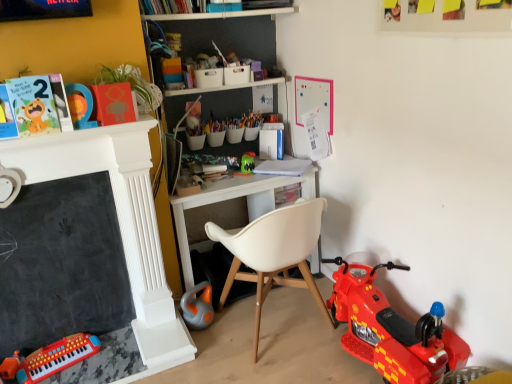
Locate an element on the screen. The height and width of the screenshot is (384, 512). vacant space that's between orange plastic toy at lower center, which ranks as the 3th toy in right-to-left order, and shiny plastic toy motorcycle at lower right, positioned as the first toy in right-to-left order is located at coordinates (281, 339).